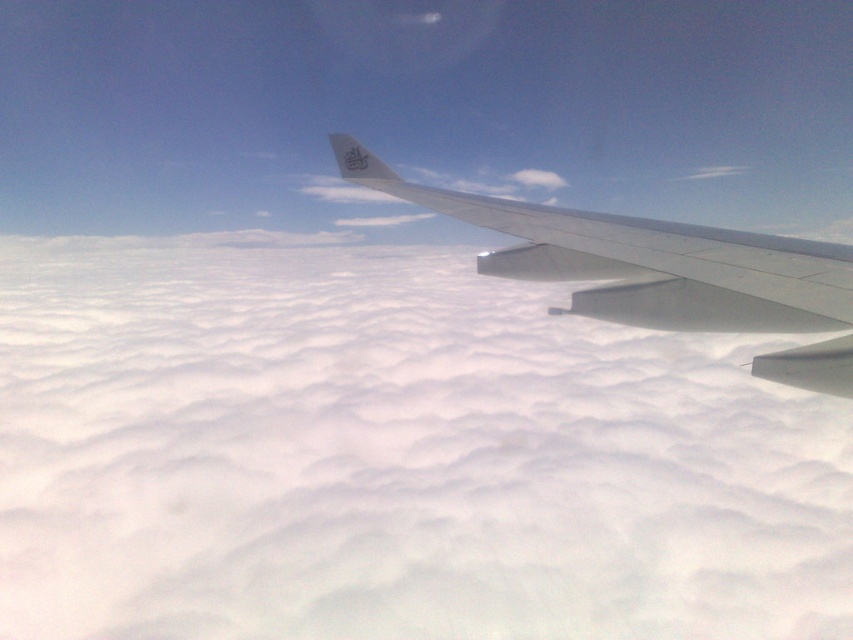
Is white fluffy cloud at upper center positioned before metallic gray wing at center?

No, white fluffy cloud at upper center is behind metallic gray wing at center.

Which is behind, point (39, 490) or point (688, 262)?

The point (39, 490) is more distant.

At what (x,y) coordinates should I click in order to perform the action: click on white fluffy cloud at upper center. Please return your answer as a coordinate pair (x, y). The width and height of the screenshot is (853, 640). Looking at the image, I should click on (392, 456).